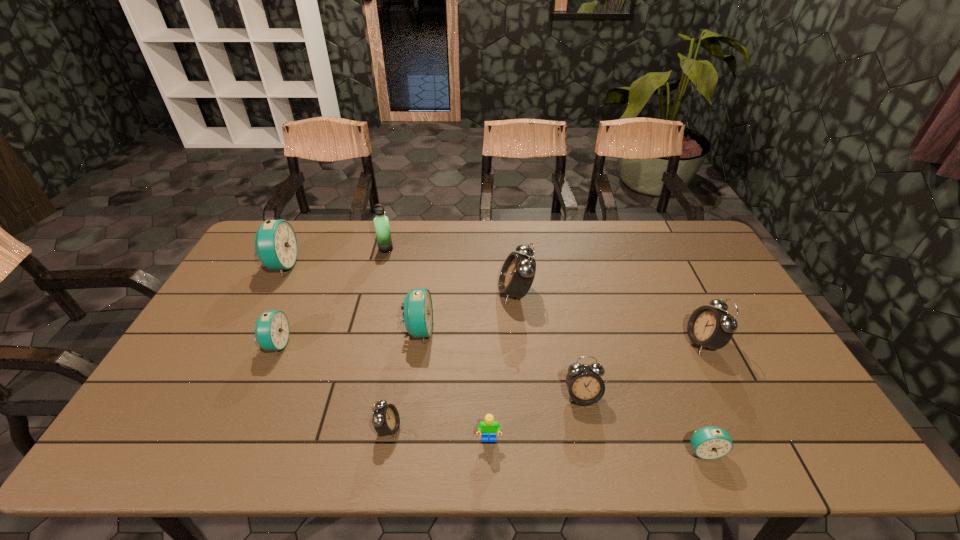
The image size is (960, 540). In order to click on thermos bottle in this screenshot , I will do `click(381, 222)`.

At what (x,y) coordinates should I click in order to perform the action: click on the leftmost blue alarm clock. Please return your answer as a coordinate pair (x, y). Looking at the image, I should click on (276, 246).

At what (x,y) coordinates should I click in order to perform the action: click on the farthest blue alarm clock. Please return your answer as a coordinate pair (x, y). This screenshot has width=960, height=540. Looking at the image, I should click on (276, 246).

Identify the location of the farthest white alarm clock. The image size is (960, 540). (517, 274).

Locate an element on the screen. The image size is (960, 540). the biggest white alarm clock is located at coordinates (517, 274).

I want to click on the rightmost alarm clock, so (x=710, y=327).

The height and width of the screenshot is (540, 960). In order to click on the rightmost object in this screenshot , I will do `click(710, 327)`.

Find the location of `the second biggest blue alarm clock`. the second biggest blue alarm clock is located at coordinates (418, 311).

In order to click on the third biggest blue alarm clock in this screenshot , I will do `click(272, 329)`.

Where is `the third blue alarm clock from right to left`? The width and height of the screenshot is (960, 540). the third blue alarm clock from right to left is located at coordinates (272, 329).